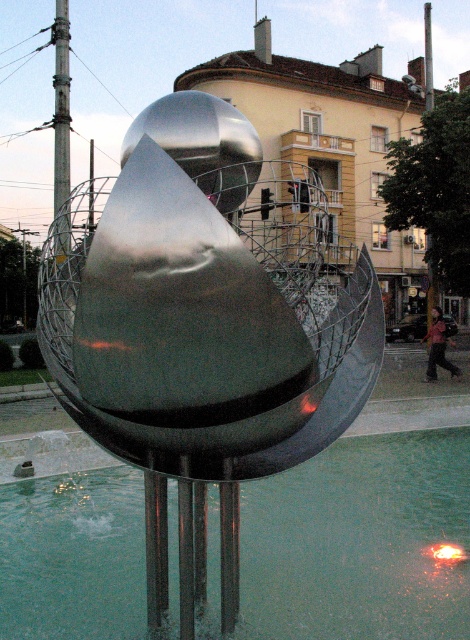
You are standing in front of the metallic sculpture and notice two points marked on the ground at coordinates point (x=347, y=349) and point (x=351, y=528). If you want to walk towards the sculpture, which point should you step on first to ensure you are moving in the correct direction?

You should step on point (x=347, y=349) first because it is in front of point (x=351, y=528), meaning it is closer to the sculpture and aligns with the direction you want to move.

You are an artist planning to photograph the shiny metallic sculpture at center and the clear glass water at center. Which object should you focus on first if you want to capture the one that takes up more space in your photo?

The shiny metallic sculpture at center is larger in size than clear glass water at center, so you should focus on the shiny metallic sculpture at center first to capture the one that takes up more space in your photo.

You are standing in a public square and want to take a photo of the shiny metallic sculpture at center. If your camera can focus on objects up to 10 feet away, will you need to move closer or farther away to ensure the sculpture is in focus?

The shiny metallic sculpture at center is 7.24 feet away from you. Since your camera can focus up to 10 feet, you don not need to move closer or farther away. The sculpture is within the camera focus range.